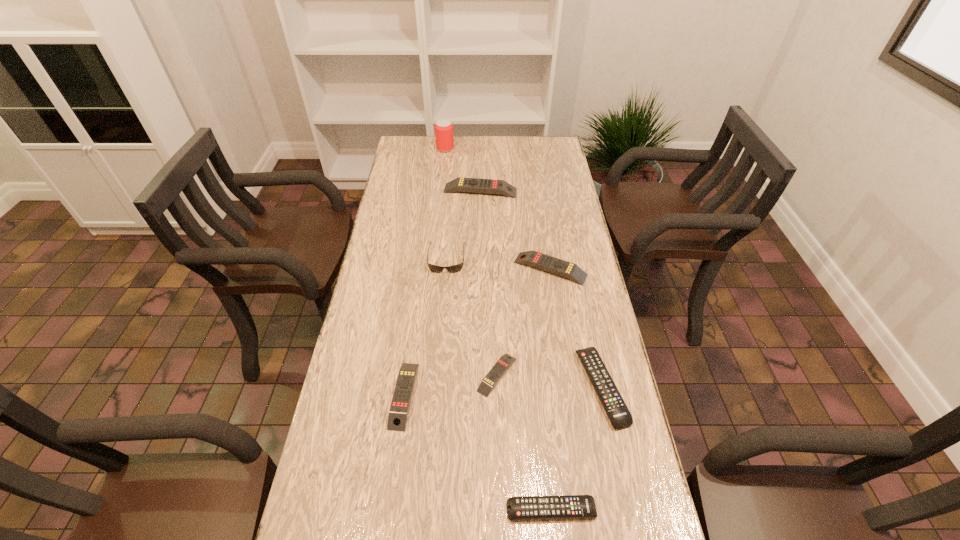
Where is `the farther black remote control`? Image resolution: width=960 pixels, height=540 pixels. the farther black remote control is located at coordinates (619, 415).

Image resolution: width=960 pixels, height=540 pixels. In order to click on the nearest object in this screenshot , I will do `click(567, 506)`.

At what (x,y) coordinates should I click in order to perform the action: click on the left black remote control. Please return your answer as a coordinate pair (x, y). The image size is (960, 540). Looking at the image, I should click on (567, 506).

Identify the location of the smallest yellow remote control. The height and width of the screenshot is (540, 960). (498, 370).

Image resolution: width=960 pixels, height=540 pixels. I want to click on free region located on the right of the tallest object, so click(518, 148).

Image resolution: width=960 pixels, height=540 pixels. What are the coordinates of `free point located 0.180m on the back of the tallest remote control` in the screenshot? It's located at (480, 160).

At what (x,y) coordinates should I click in order to perform the action: click on vacant space located on the front-facing side of the sunglasses. Please return your answer as a coordinate pair (x, y). The width and height of the screenshot is (960, 540). Looking at the image, I should click on (444, 285).

You are a GUI agent. You are given a task and a screenshot of the screen. Output one action in this format:
    pyautogui.click(x=<x>, y=<y>)
    Task: Click on the free space located on the front of the second farthest yellow remote control
    This screenshot has height=540, width=960.
    Given the screenshot: What is the action you would take?
    pyautogui.click(x=559, y=323)

Locate an element on the screen. vacant space located 0.340m on the right of the leftmost yellow remote control is located at coordinates (548, 395).

The height and width of the screenshot is (540, 960). I want to click on vacant space located on the back of the farther black remote control, so click(x=588, y=323).